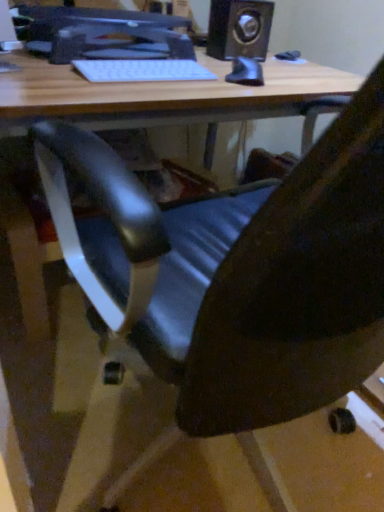
I want to click on vacant space situated above white matte keyboard at upper center (from a real-world perspective), so click(x=140, y=65).